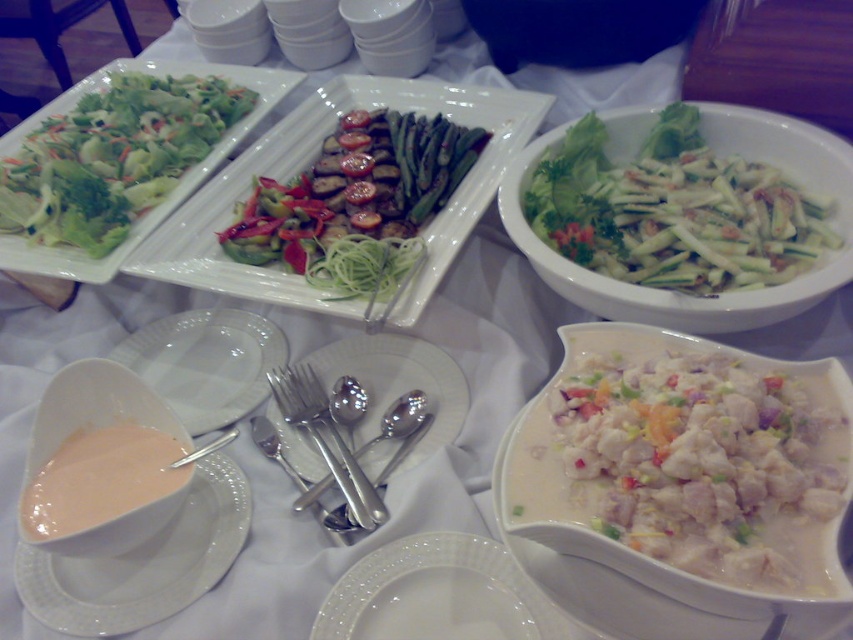
Between point (163, 253) and point (55, 376), which one is positioned behind?

The point (163, 253) is behind.

Describe the element at coordinates (310, 163) in the screenshot. I see `green matte salad at upper center` at that location.

Locate an element on the screen. The width and height of the screenshot is (853, 640). green matte salad at upper center is located at coordinates (310, 163).

Measure the distance from green matte salad at center to green leafy salad at upper left.

9.32 inches

Which is more to the right, green matte salad at center or green leafy salad at upper left?

Positioned to the right is green matte salad at center.

Between point (280, 250) and point (26, 122), which one is positioned in front?

Point (280, 250)

I want to click on green matte salad at center, so click(x=355, y=189).

Is green matte salad bowl at center wider than white porcelain plate at center?

Indeed, green matte salad bowl at center has a greater width compared to white porcelain plate at center.

Is green matte salad bowl at center further to the viewer compared to white porcelain plate at center?

No, green matte salad bowl at center is closer to the viewer.

The image size is (853, 640). What are the coordinates of `green matte salad bowl at center` in the screenshot? It's located at (720, 292).